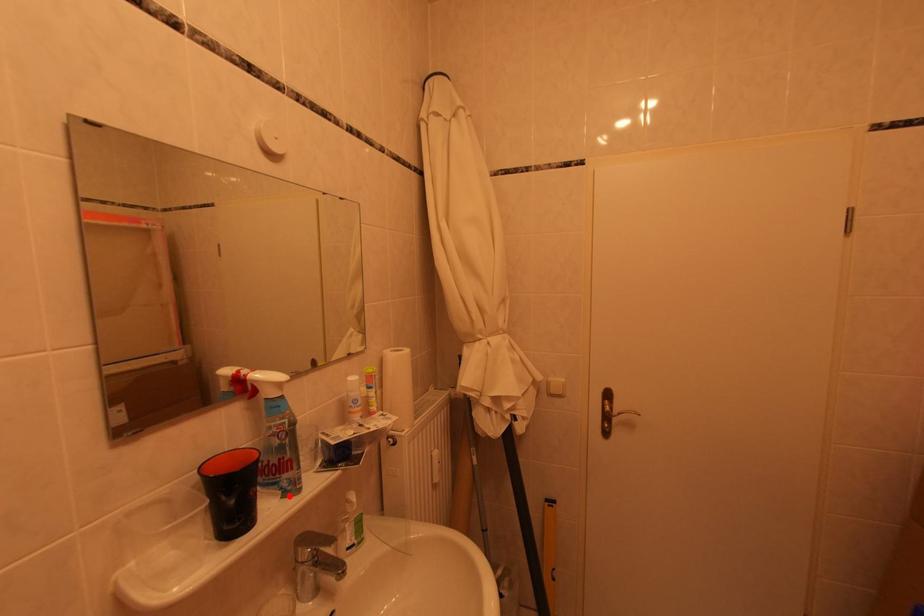
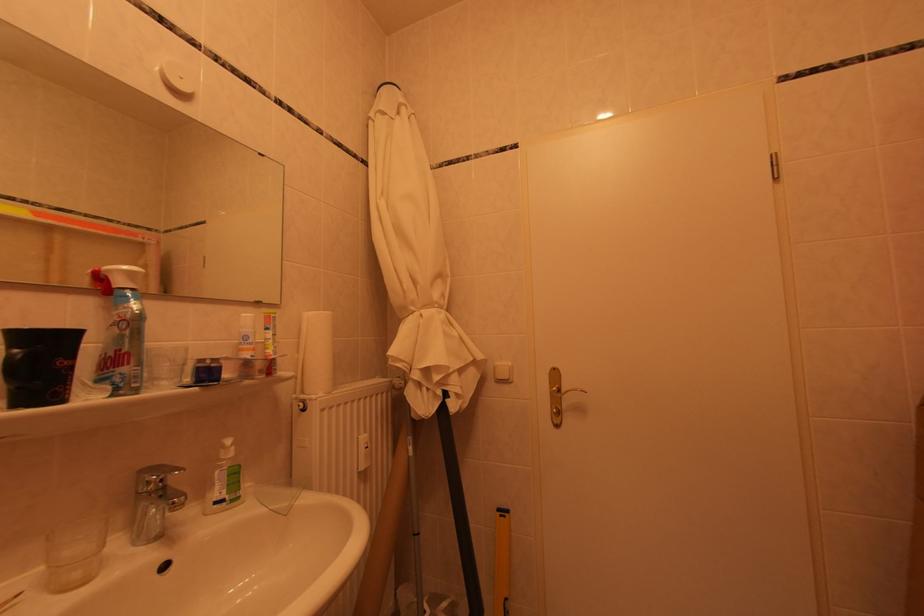
Find the pixel in the second image that matches the highlighted location in the first image.

(119, 391)